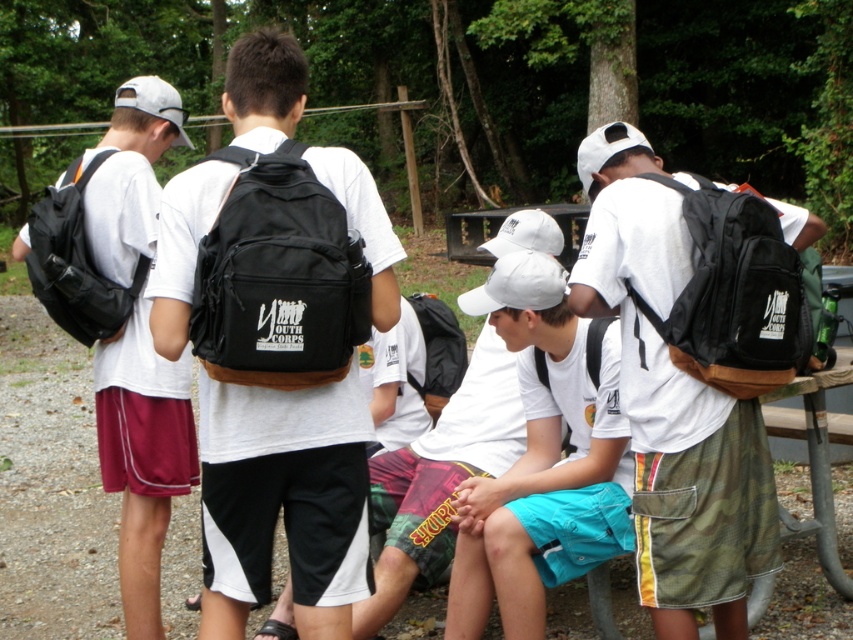
The width and height of the screenshot is (853, 640). What do you see at coordinates (277, 276) in the screenshot?
I see `black fabric backpack at center` at bounding box center [277, 276].

Which is behind, point (341, 256) or point (357, 385)?

Positioned behind is point (357, 385).

Is point (196, 292) more distant than point (277, 74)?

No.

Find the location of a particular element. black fabric backpack at center is located at coordinates (277, 276).

Between point (460, 305) and point (283, 275), which one is positioned in front?

Point (283, 275) is more forward.

At what (x,y) coordinates should I click in order to perform the action: click on white matte cap at center. Please return your answer as a coordinate pair (x, y). The height and width of the screenshot is (640, 853). Looking at the image, I should click on (541, 460).

The height and width of the screenshot is (640, 853). Identify the location of matte black backpack at left. (125, 328).

Is matte black backpack at left to the right of black fabric backpack at center from the viewer's perspective?

No, matte black backpack at left is not to the right of black fabric backpack at center.

I want to click on matte black backpack at left, so click(125, 328).